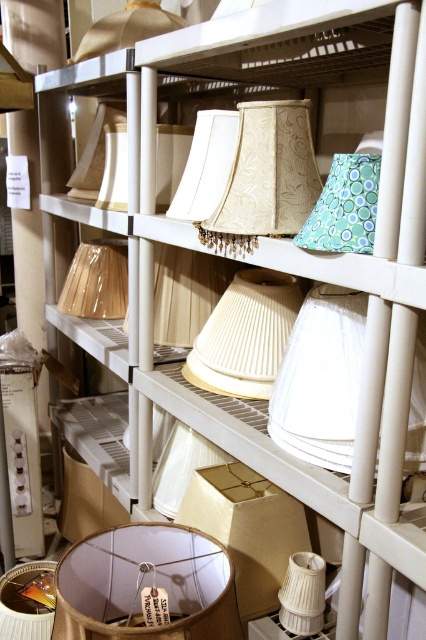
Question: Which point appears closest to the camera in this image?

Choices:
 (A) 327,449
 (B) 141,24

Answer: (A)

Question: Which point appears farthest from the camera in this image?

Choices:
 (A) (150, 554)
 (B) (212, 147)
 (C) (420, 461)

Answer: (B)

Question: Which object appears closest to the camera in this image?

Choices:
 (A) beige pleated lampshade at center
 (B) white fabric lampshade at center

Answer: (B)

Question: Where is matte cream fabric lampshade at center located in relation to matte beige lampshade at upper left in the image?

Choices:
 (A) left
 (B) right

Answer: (B)

Question: Is beige fabric lampshade at center closer to the viewer compared to matte beige lampshade at upper left?

Choices:
 (A) no
 (B) yes

Answer: (B)

Question: Does white fabric lampshade at center appear on the left side of matte cream fabric lampshade at center?

Choices:
 (A) yes
 (B) no

Answer: (B)